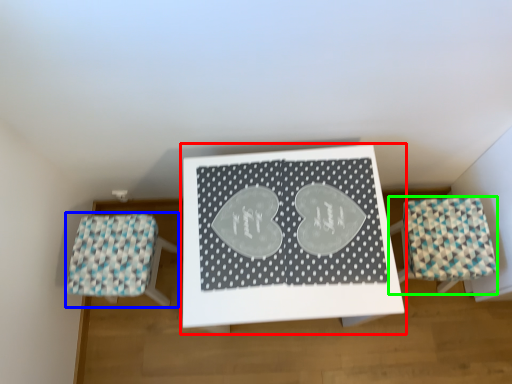
Question: Which object is the farthest from table (highlighted by a red box)? Choose among these: furniture (highlighted by a blue box) or furniture (highlighted by a green box).

Choices:
 (A) furniture
 (B) furniture

Answer: (A)